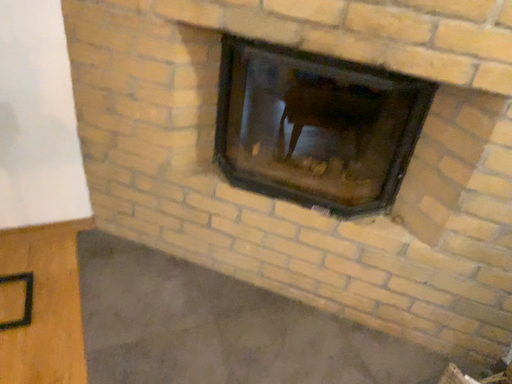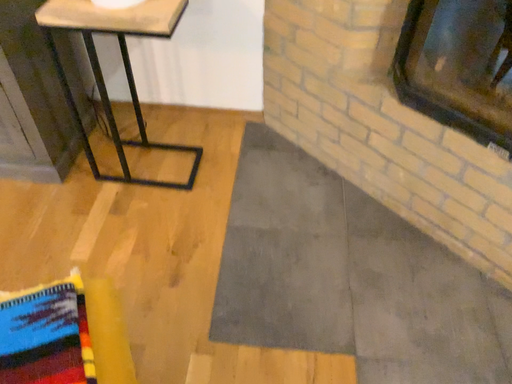
Question: How did the camera likely rotate when shooting the video?

Choices:
 (A) rotated right
 (B) rotated left

Answer: (B)